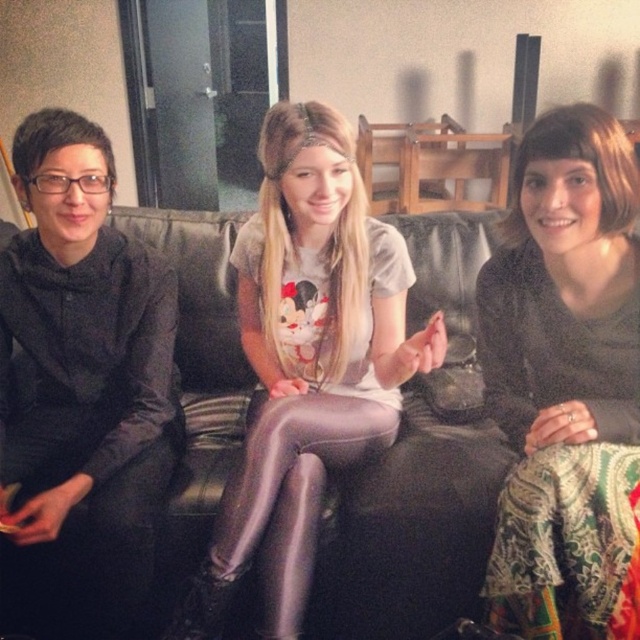
Can you confirm if black leather couch at center is positioned to the left of matte purple leggings at center?

Yes, black leather couch at center is to the left of matte purple leggings at center.

Which of these two, black leather couch at center or matte purple leggings at center, stands taller?

black leather couch at center

Locate an element on the screen. The height and width of the screenshot is (640, 640). black leather couch at center is located at coordinates (420, 467).

Based on the photo, who is positioned more to the left, black matte jacket at left or black textured skirt at lower right?

black matte jacket at left

Is black matte jacket at left wider than black textured skirt at lower right?

Yes, black matte jacket at left is wider than black textured skirt at lower right.

What do you see at coordinates (81, 392) in the screenshot?
I see `black matte jacket at left` at bounding box center [81, 392].

The width and height of the screenshot is (640, 640). I want to click on black matte jacket at left, so click(81, 392).

Is the position of black matte jacket at left less distant than that of black leather couch at center?

Yes, it is.

Who is more forward, (67, 493) or (403, 504)?

Positioned in front is point (67, 493).

Image resolution: width=640 pixels, height=640 pixels. In order to click on black matte jacket at left in this screenshot , I will do `click(81, 392)`.